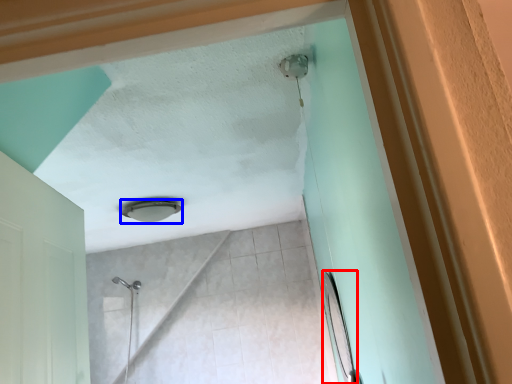
Question: Which object is further to the camera taking this photo, mirror (highlighted by a red box) or lamp (highlighted by a blue box)?

Choices:
 (A) mirror
 (B) lamp

Answer: (B)